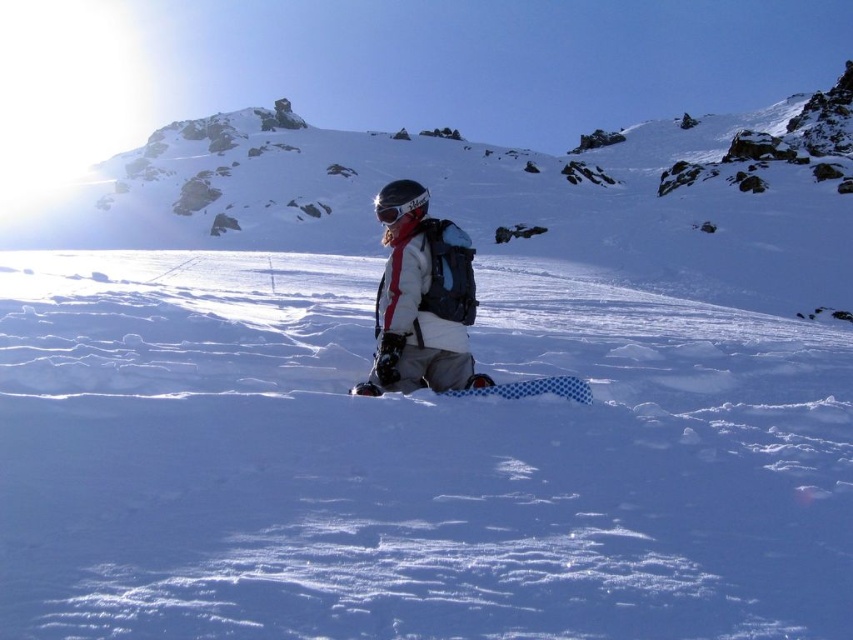
Question: Which object is positioned closest to the blue checkered snowboard at center?

Choices:
 (A) white matte jacket at center
 (B) matte black goggles at center

Answer: (A)

Question: Estimate the real-world distances between objects in this image. Which object is closer to the white matte jacket at center?

Choices:
 (A) matte black goggles at center
 (B) blue checkered snowboard at center

Answer: (B)

Question: Which point appears farthest from the camera in this image?

Choices:
 (A) (403, 202)
 (B) (427, 371)

Answer: (A)

Question: Can you confirm if blue checkered snowboard at center is positioned to the left of matte black goggles at center?

Choices:
 (A) no
 (B) yes

Answer: (A)

Question: Does white matte jacket at center lie in front of blue checkered snowboard at center?

Choices:
 (A) yes
 (B) no

Answer: (B)

Question: Does white matte jacket at center appear on the right side of blue checkered snowboard at center?

Choices:
 (A) yes
 (B) no

Answer: (B)